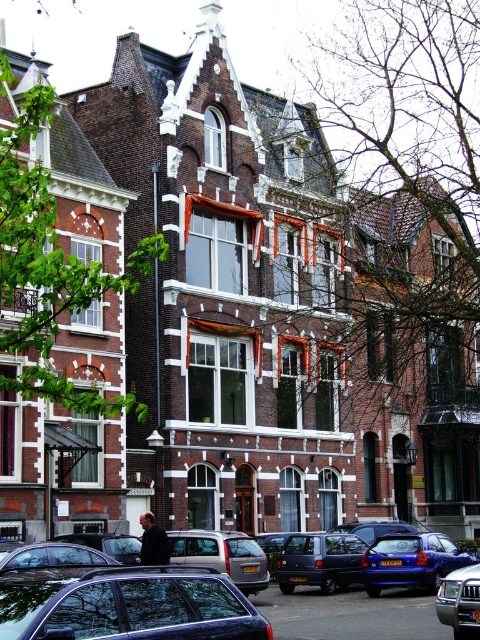
Question: Which object is positioned farthest from the metallic blue hatchback at center?

Choices:
 (A) matte black car at lower left
 (B) shiny silver suv at lower right
 (C) matte black car at center

Answer: (A)

Question: Can you confirm if shiny blue sedan at lower left is positioned to the right of silver metallic van at center?

Choices:
 (A) yes
 (B) no

Answer: (A)

Question: Estimate the real-world distances between objects in this image. Which object is farther from the silver metallic van at center?

Choices:
 (A) matte black car at lower left
 (B) metallic blue hatchback at center
 (C) shiny silver suv at lower right
 (D) matte black car at center

Answer: (A)

Question: Can you confirm if metallic blue hatchback at center is positioned to the right of silver metallic van at center?

Choices:
 (A) no
 (B) yes

Answer: (B)

Question: Does shiny blue sedan at lower left have a greater width compared to metallic blue hatchback at center?

Choices:
 (A) no
 (B) yes

Answer: (B)

Question: Which point is closer to the camera?

Choices:
 (A) (116, 611)
 (B) (49, 584)

Answer: (A)